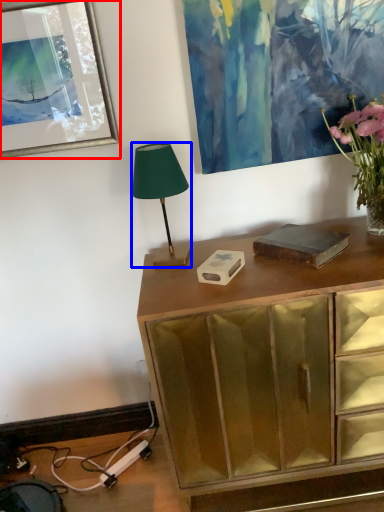
Question: Which of the following is the farthest to the observer, picture frame (highlighted by a red box) or lamp (highlighted by a blue box)?

Choices:
 (A) picture frame
 (B) lamp

Answer: (A)